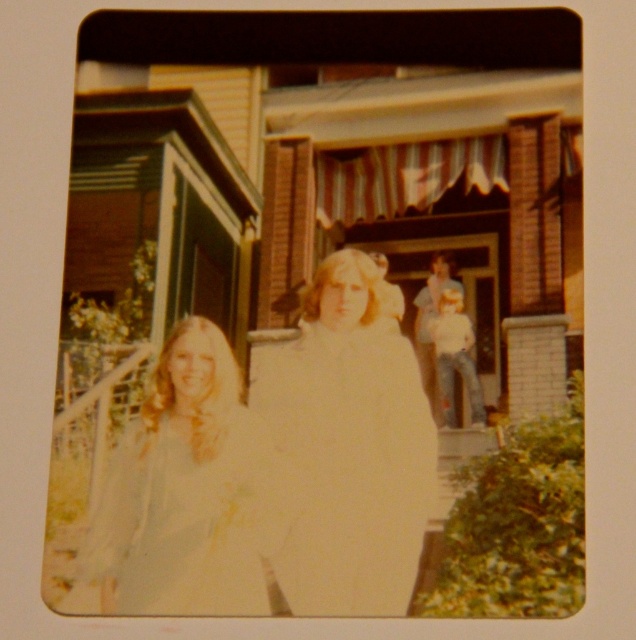
Question: Observing the image, what is the correct spatial positioning of white cotton dress at center in reference to light blue fabric dress at left?

Choices:
 (A) left
 (B) right

Answer: (B)

Question: Which point is closer to the camera?

Choices:
 (A) white cotton dress at center
 (B) light blue fabric dress at left

Answer: (B)

Question: Can you confirm if white cotton dress at center is positioned to the right of light blue fabric dress at left?

Choices:
 (A) no
 (B) yes

Answer: (B)

Question: Which point is closer to the camera?

Choices:
 (A) white cotton dress at center
 (B) light blue fabric dress at left

Answer: (B)

Question: Is white cotton dress at center positioned before light blue fabric dress at left?

Choices:
 (A) no
 (B) yes

Answer: (A)